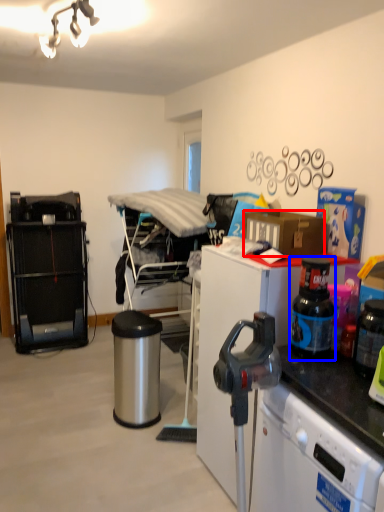
Question: Which object appears farthest to the camera in this image, box (highlighted by a red box) or bottle (highlighted by a blue box)?

Choices:
 (A) box
 (B) bottle

Answer: (A)